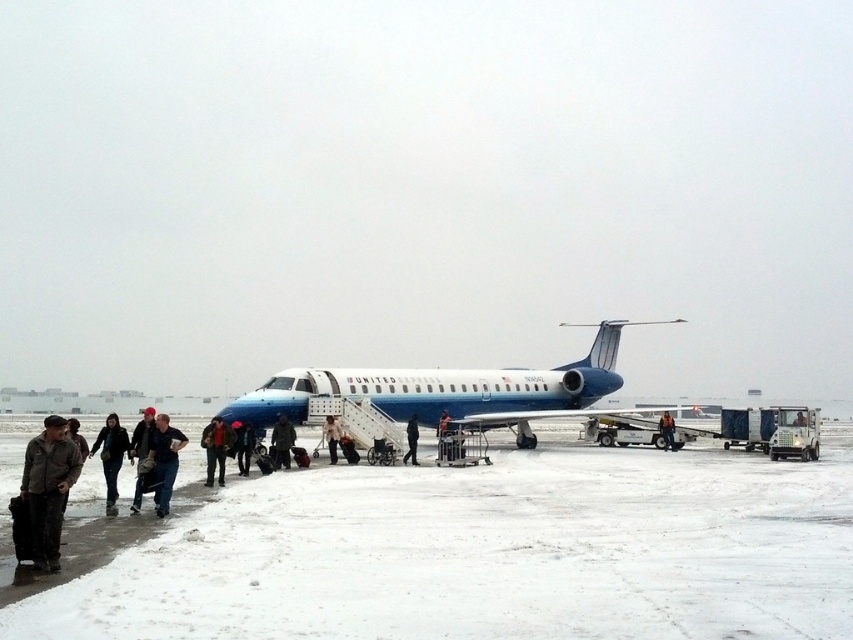
Does dark blue jeans at lower left have a lesser width compared to dark blue uniform at center?

In fact, dark blue jeans at lower left might be wider than dark blue uniform at center.

Between point (173, 435) and point (668, 449), which one is positioned behind?

The point (668, 449) is behind.

Between point (172, 435) and point (660, 428), which one is positioned behind?

The point (660, 428) is more distant.

The width and height of the screenshot is (853, 640). I want to click on dark blue jeans at lower left, so click(164, 460).

Does point (438, 376) come closer to viewer compared to point (274, 435)?

No, it is not.

Is point (534, 412) positioned behind point (280, 417)?

Yes, it is.

The height and width of the screenshot is (640, 853). I want to click on blue metallic airplane at center, so coord(444,392).

Can you confirm if dark brown leather jacket at lower left is shorter than dark blue uniform at center?

No, dark brown leather jacket at lower left is not shorter than dark blue uniform at center.

Who is lower down, dark brown leather jacket at lower left or dark blue uniform at center?

Positioned lower is dark blue uniform at center.

Does point (54, 528) come closer to viewer compared to point (666, 417)?

Yes, point (54, 528) is in front of point (666, 417).

Where is `dark brown leather jacket at lower left`? The height and width of the screenshot is (640, 853). dark brown leather jacket at lower left is located at coordinates (48, 488).